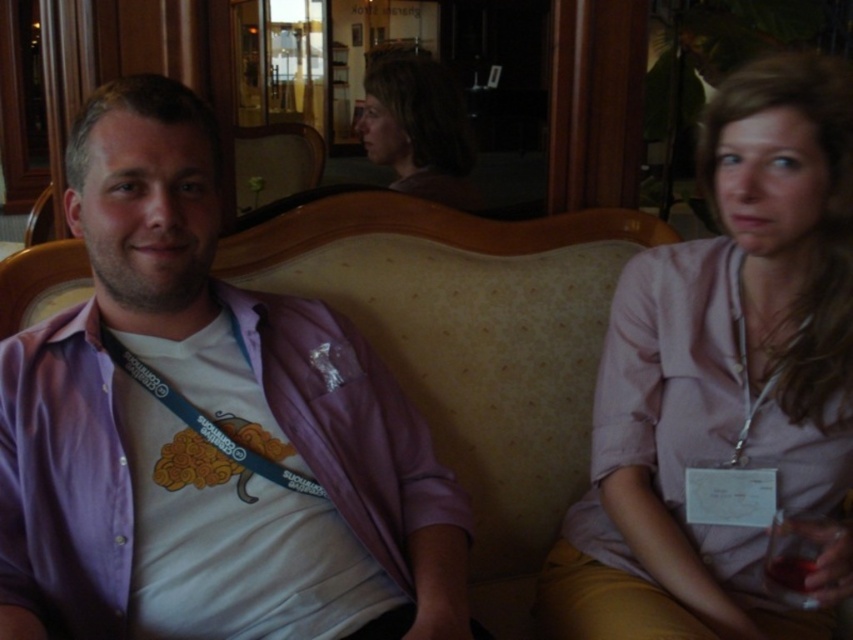
Question: Is pink fabric shirt at center thinner than blue fabric lanyard at center?

Choices:
 (A) no
 (B) yes

Answer: (A)

Question: Which object appears closest to the camera in this image?

Choices:
 (A) blue fabric lanyard at center
 (B) purple cotton shirt at left
 (C) matte brown hair at center
 (D) pink fabric shirt at center

Answer: (B)

Question: Where is purple cotton shirt at left located in relation to blue fabric lanyard at center in the image?

Choices:
 (A) below
 (B) above

Answer: (A)

Question: Can you confirm if matte brown hair at center is thinner than blue fabric lanyard at center?

Choices:
 (A) no
 (B) yes

Answer: (B)

Question: Which of the following is the farthest from the observer?

Choices:
 (A) (201, 196)
 (B) (722, 604)
 (C) (428, 164)

Answer: (C)

Question: Which point appears farthest from the camera in this image?

Choices:
 (A) (103, 324)
 (B) (793, 209)

Answer: (A)